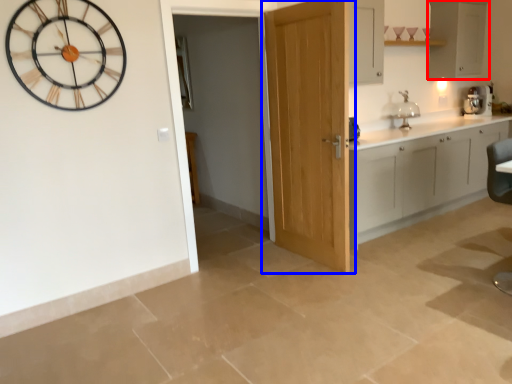
Question: Which object is closer to the camera taking this photo, cabinetry (highlighted by a red box) or door (highlighted by a blue box)?

Choices:
 (A) cabinetry
 (B) door

Answer: (B)